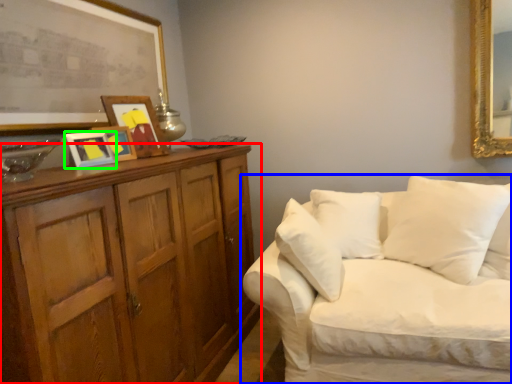
Question: Which object is positioned closest to cabinetry (highlighted by a red box)? Select from studio couch (highlighted by a blue box) and picture frame (highlighted by a green box).

Choices:
 (A) studio couch
 (B) picture frame

Answer: (B)